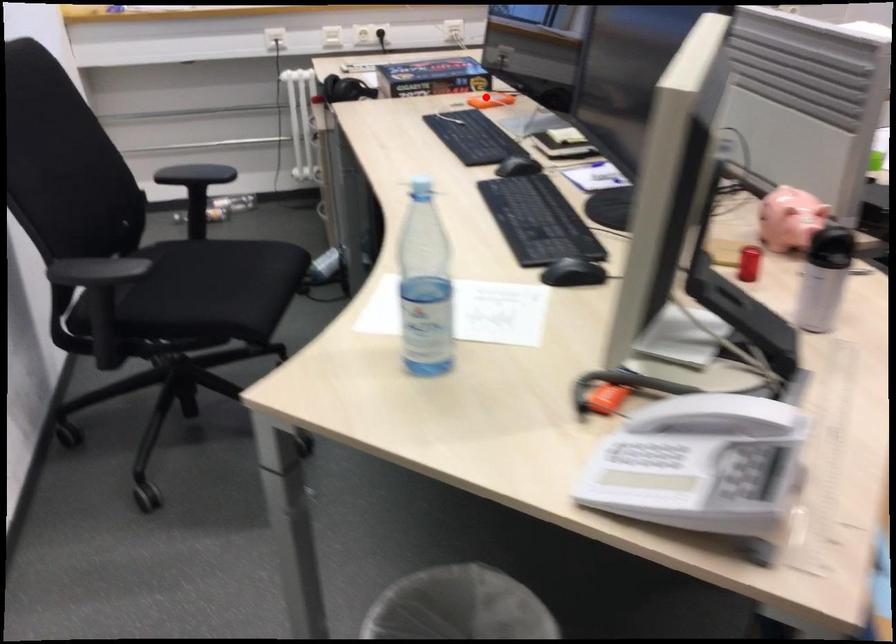
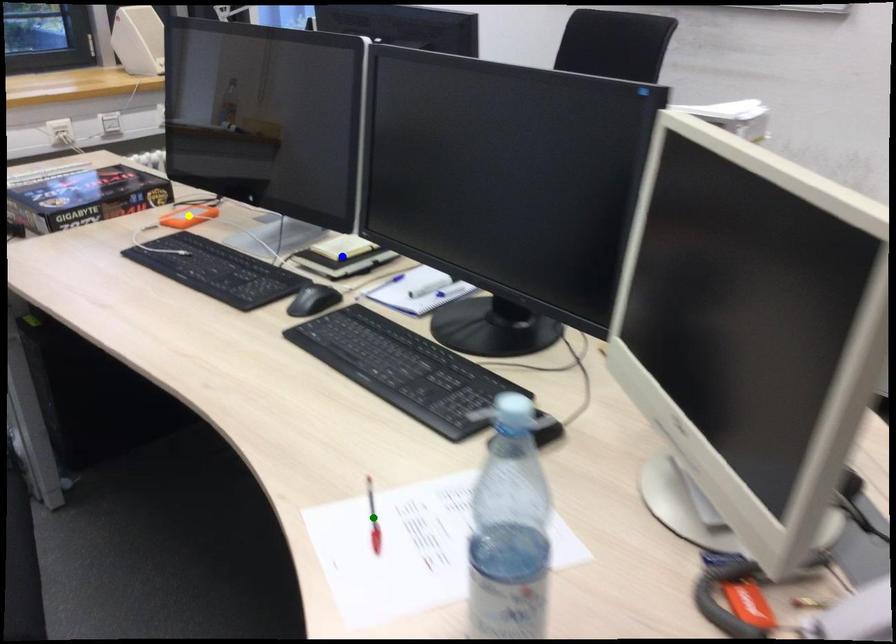
Question: I am providing you with two images of the same scene from different viewpoints. A red point is marked on the first image. You are given multiple points on the second image. Which mark in image 2 goes with the point in image 1?

Choices:
 (A) green point
 (B) yellow point
 (C) blue point

Answer: (B)